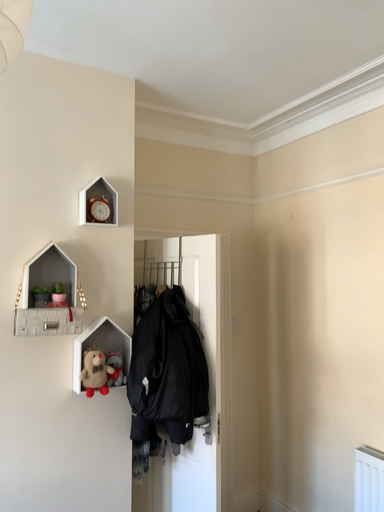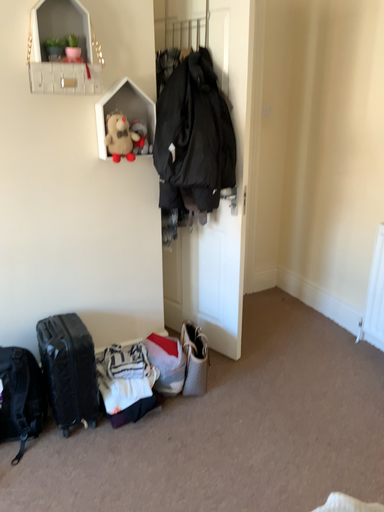
Question: Which way did the camera rotate in the video?

Choices:
 (A) rotated upward
 (B) rotated downward

Answer: (B)